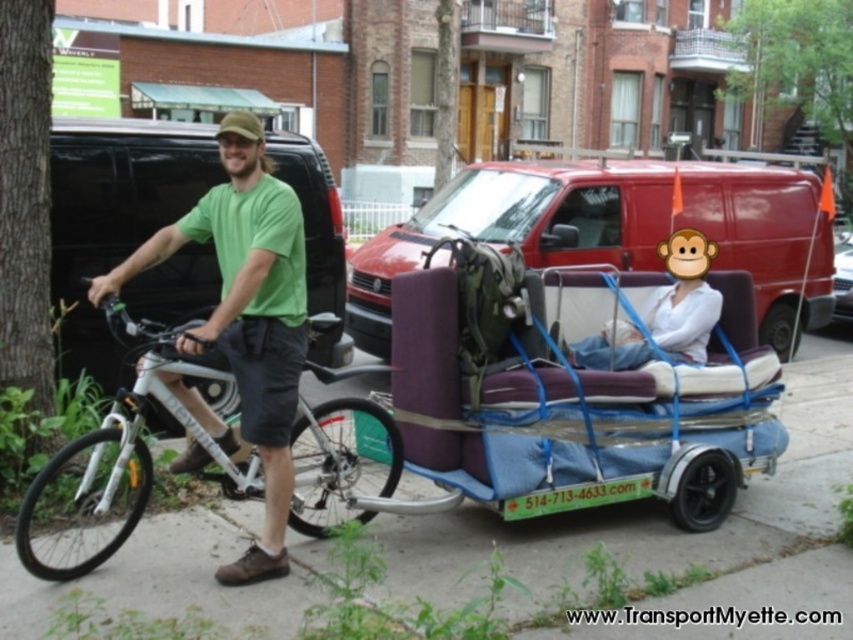
Is green matte shirt at center taller than white matte bicycle at left?

Yes, green matte shirt at center is taller than white matte bicycle at left.

The height and width of the screenshot is (640, 853). What do you see at coordinates (244, 320) in the screenshot?
I see `green matte shirt at center` at bounding box center [244, 320].

The height and width of the screenshot is (640, 853). I want to click on green matte shirt at center, so click(x=244, y=320).

Can you confirm if matte purple couch at center is smaller than metallic silver van at center?

Correct, matte purple couch at center occupies less space than metallic silver van at center.

Is matte purple couch at center closer to the viewer compared to metallic silver van at center?

Yes, matte purple couch at center is in front of metallic silver van at center.

You are a GUI agent. You are given a task and a screenshot of the screen. Output one action in this format:
    pyautogui.click(x=<x>, y=<y>)
    Task: Click on the matte purple couch at center
    The height and width of the screenshot is (640, 853).
    Given the screenshot: What is the action you would take?
    pyautogui.click(x=518, y=227)

The width and height of the screenshot is (853, 640). I want to click on matte purple couch at center, so click(x=518, y=227).

What do you see at coordinates (518, 227) in the screenshot? The height and width of the screenshot is (640, 853). I see `matte purple couch at center` at bounding box center [518, 227].

Is matte purple couch at center positioned behind green matte shirt at center?

Yes, it is behind green matte shirt at center.

Find the location of a particular element. The image size is (853, 640). matte purple couch at center is located at coordinates click(x=518, y=227).